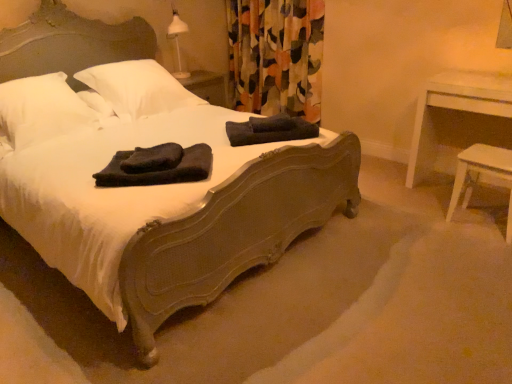
Question: Does matte dark wood bed at center appear on the left side of white soft pillow at upper left, the first pillow positioned from the left?

Choices:
 (A) no
 (B) yes

Answer: (A)

Question: Are matte dark wood bed at center and white soft pillow at upper left, the first pillow positioned from the left, located far from each other?

Choices:
 (A) yes
 (B) no

Answer: (A)

Question: Does matte dark wood bed at center have a smaller size compared to white soft pillow at upper left, acting as the second pillow starting from the right?

Choices:
 (A) no
 (B) yes

Answer: (A)

Question: Can you confirm if matte dark wood bed at center is shorter than white soft pillow at upper left, the first pillow positioned from the left?

Choices:
 (A) no
 (B) yes

Answer: (A)

Question: From a real-world perspective, is matte dark wood bed at center over white soft pillow at upper left, acting as the second pillow starting from the right?

Choices:
 (A) yes
 (B) no

Answer: (B)

Question: Is dark cotton towels at center, placed as the second material when sorted from bottom to top, spatially inside white wood stool at lower right, or outside of it?

Choices:
 (A) outside
 (B) inside

Answer: (A)

Question: From the image's perspective, is dark cotton towels at center, arranged as the second material when viewed from the left, positioned above or below white wood stool at lower right?

Choices:
 (A) above
 (B) below

Answer: (A)

Question: In terms of width, does dark cotton towels at center, placed as the second material when sorted from bottom to top, look wider or thinner when compared to white wood stool at lower right?

Choices:
 (A) thin
 (B) wide

Answer: (B)

Question: Is dark cotton towels at center, the first material in the top-to-bottom sequence, taller or shorter than white wood stool at lower right?

Choices:
 (A) short
 (B) tall

Answer: (A)

Question: Considering the positions of multicolored fabric curtain at upper center and white wood table at right in the image, is multicolored fabric curtain at upper center taller or shorter than white wood table at right?

Choices:
 (A) short
 (B) tall

Answer: (B)

Question: Considering the positions of multicolored fabric curtain at upper center and white wood table at right in the image, is multicolored fabric curtain at upper center bigger or smaller than white wood table at right?

Choices:
 (A) big
 (B) small

Answer: (A)

Question: From the image's perspective, relative to white wood table at right, is multicolored fabric curtain at upper center above or below?

Choices:
 (A) above
 (B) below

Answer: (A)

Question: Is multicolored fabric curtain at upper center inside or outside of white wood table at right?

Choices:
 (A) inside
 (B) outside

Answer: (B)

Question: Is point (106, 170) positioned closer to the camera than point (98, 36)?

Choices:
 (A) farther
 (B) closer

Answer: (B)

Question: From the image's perspective, is black towel at center, marked as the first material in a front-to-back arrangement, above or below matte dark wood bed at center?

Choices:
 (A) above
 (B) below

Answer: (B)